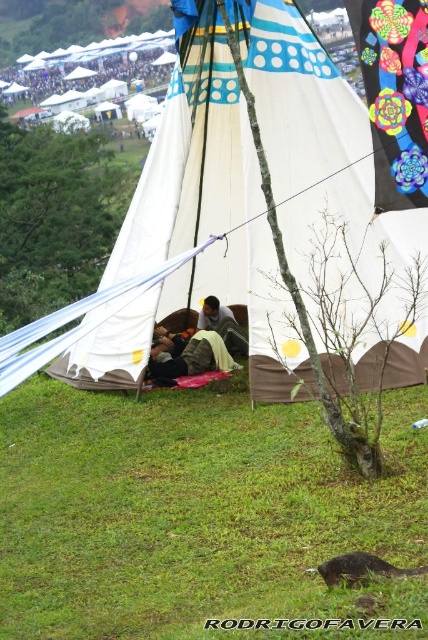
You are planning to set up a camping gear organizer that requires 8 feet of space between the white canvas tent at center and the camouflage fabric sleeping bag at center. Based on the scene, will there be enough space?

The distance between the white canvas tent at center and the camouflage fabric sleeping bag at center is 7.07 feet, which is less than the required 8 feet. Therefore, there is insufficient space for the camping gear organizer.

You are planning to set up a new tent next to the white canvas tent at center and the camouflage fabric person at center. Based on their sizes, which object requires more horizontal space to accommodate?

The white canvas tent at center requires more horizontal space because its width surpasses that of the camouflage fabric person at center.

You are setting up a campsite and need to access the camouflage fabric sleeping bag at center inside the white canvas tent at center. Can you reach it without moving the tent?

The white canvas tent at center is in front of the camouflage fabric sleeping bag at center, so you can reach the camouflage fabric sleeping bag at center by moving around or behind the tent.